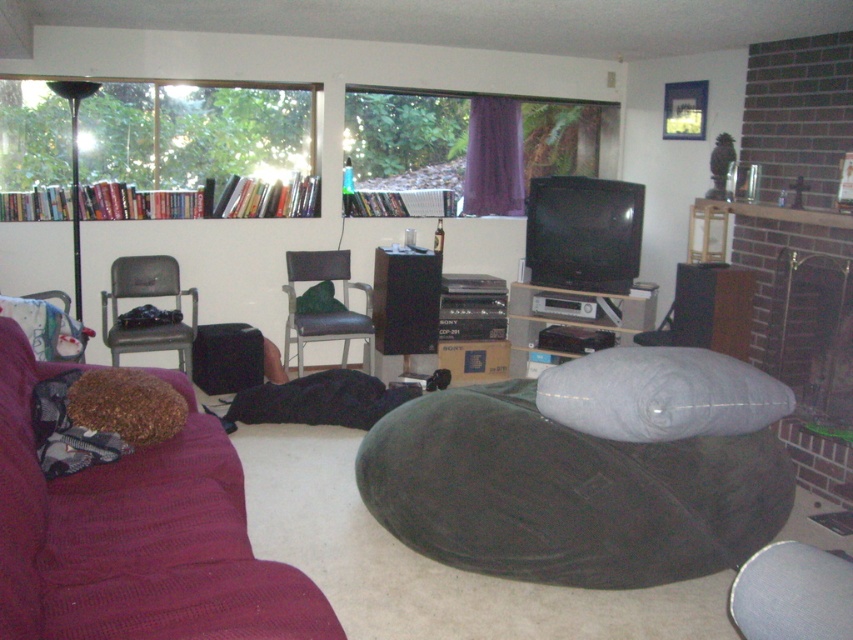
Between point (538, 326) and point (312, 259), which one is positioned in front?

Point (312, 259) is more forward.

Is matte gray electronics at center to the left of black leather chair at center from the viewer's perspective?

No, matte gray electronics at center is not to the left of black leather chair at center.

You are a GUI agent. You are given a task and a screenshot of the screen. Output one action in this format:
    pyautogui.click(x=<x>, y=<y>)
    Task: Click on the matte gray electronics at center
    The height and width of the screenshot is (640, 853).
    Given the screenshot: What is the action you would take?
    pyautogui.click(x=569, y=321)

Find the location of a particular element. matte gray electronics at center is located at coordinates (569, 321).

Which is more to the right, black matte speaker at center or black leather chair at center?

Positioned to the right is black matte speaker at center.

Between point (389, 253) and point (283, 364), which one is positioned in front?

Point (389, 253) is in front.

Is point (413, 280) in front of point (288, 310)?

Yes, it is.

You are a GUI agent. You are given a task and a screenshot of the screen. Output one action in this format:
    pyautogui.click(x=<x>, y=<y>)
    Task: Click on the black matte speaker at center
    
    Given the screenshot: What is the action you would take?
    pyautogui.click(x=405, y=300)

Between point (656, 396) and point (743, 328), which one is positioned behind?

Positioned behind is point (743, 328).

Which is in front, point (683, 378) or point (698, 307)?

Point (683, 378) is in front.

Identify the location of gray fabric pillow at center. (660, 394).